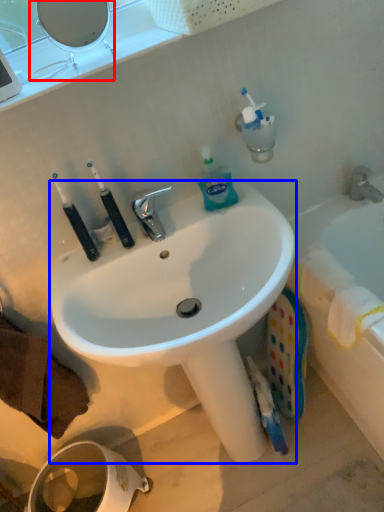
Question: Which object appears closest to the camera in this image, mirror (highlighted by a red box) or sink (highlighted by a blue box)?

Choices:
 (A) mirror
 (B) sink

Answer: (B)